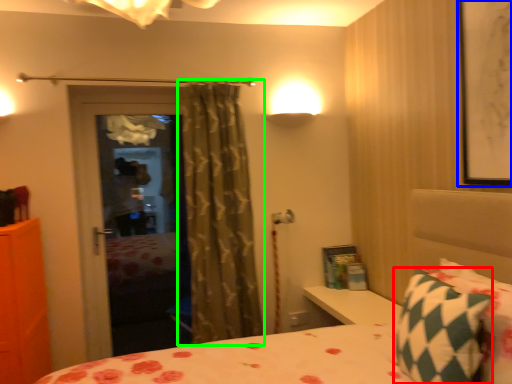
Question: Which is nearer to the pillow (highlighted by a red box)? picture frame (highlighted by a blue box) or curtain (highlighted by a green box).

Choices:
 (A) picture frame
 (B) curtain

Answer: (A)